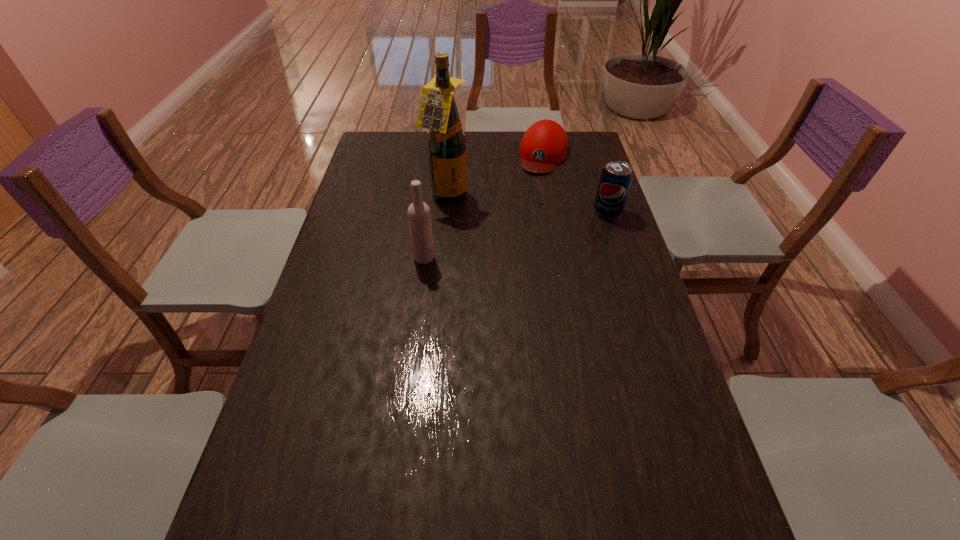
At what (x,y) coordinates should I click in order to perform the action: click on free space at the left edge. Please return your answer as a coordinate pair (x, y). The image size is (960, 540). Looking at the image, I should click on (341, 371).

This screenshot has height=540, width=960. What are the coordinates of `blank space at the right edge of the desktop` in the screenshot? It's located at (659, 329).

In the image, there is a desktop. Where is `vacant space at the near right corner`? The height and width of the screenshot is (540, 960). vacant space at the near right corner is located at coordinates (697, 476).

Find the location of a particular element. free space between the nearest object and the soda can is located at coordinates (516, 235).

The image size is (960, 540). Identify the location of vacant space in between the liquor and the vodka. (436, 228).

In order to click on free spot between the liquor and the shortest object in this screenshot , I will do `click(495, 177)`.

I want to click on vacant space in between the farthest object and the third tallest object, so click(x=576, y=184).

Where is `free spot between the third tallest object and the vodka`? free spot between the third tallest object and the vodka is located at coordinates (516, 235).

Locate an element on the screen. This screenshot has width=960, height=540. vacant space that is in between the vodka and the liquor is located at coordinates (436, 228).

Image resolution: width=960 pixels, height=540 pixels. Find the location of `blank region between the vodka and the soda can`. blank region between the vodka and the soda can is located at coordinates (516, 235).